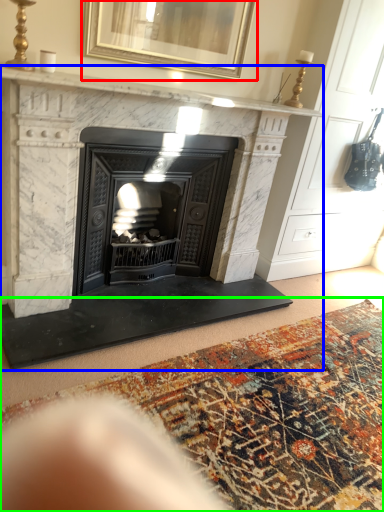
Question: Estimate the real-world distances between objects in this image. Which object is closer to picture frame (highlighted by a red box), fireplace (highlighted by a blue box) or mat (highlighted by a green box)?

Choices:
 (A) fireplace
 (B) mat

Answer: (A)